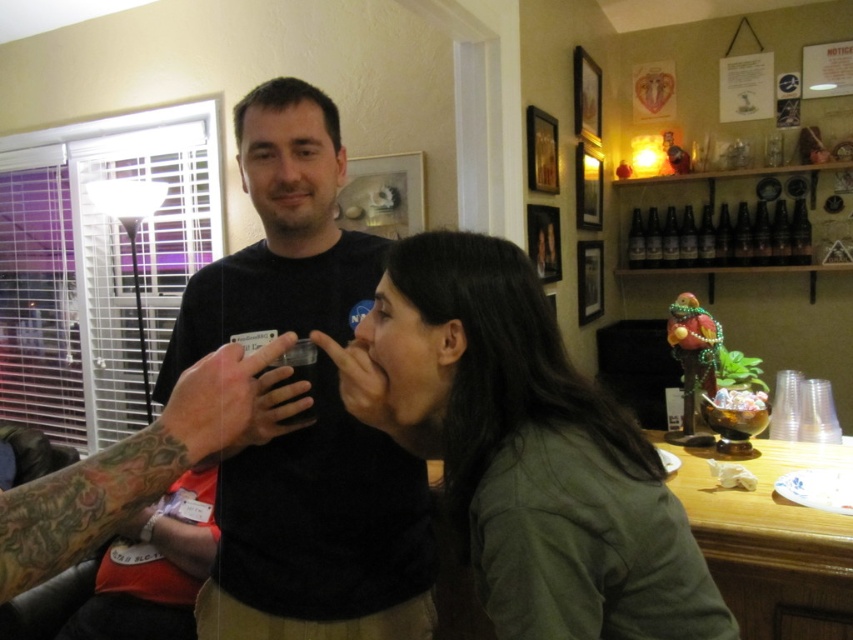
In the scene shown: You are designing a layout for a magazine spread and need to place the black matte shirt at upper center and the translucent plastic cup at left in a way that maintains their size relationship. Which object should you make larger in the design?

The black matte shirt at upper center should be made larger than the translucent plastic cup at left to maintain their size relationship as shown in the image.

You are organizing a charity event and need to arrange two donated shirts on a display rack. The green matte shirt at center and the black matte shirt at upper center are available. If the rack has a limited width, which shirt should you place first to ensure both fit?

The black matte shirt at upper center should be placed first since the green matte shirt at center might be wider, allowing more space for it afterward.

You are standing in the room and want to hand a gift to the person wearing the green matte shirt at center. Based on their position, where should you aim to place the gift so they can easily reach it?

The green matte shirt at center is located at coordinates point (525,449), so you should aim to place the gift near that position for easy reach.